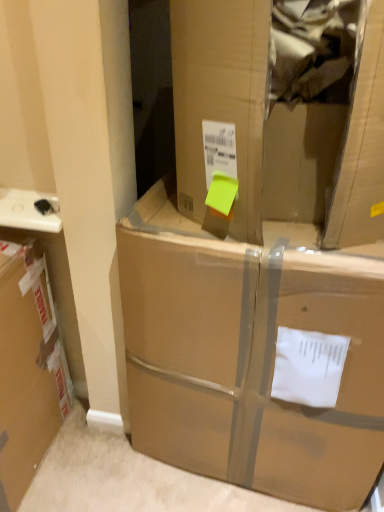
Question: Considering the positions of brown cardboard box at center and brown cardboard box at center in the image, is brown cardboard box at center bigger or smaller than brown cardboard box at center?

Choices:
 (A) big
 (B) small

Answer: (A)

Question: In the image, is brown cardboard box at center on the left side or the right side of brown cardboard box at center?

Choices:
 (A) left
 (B) right

Answer: (A)

Question: Is point (188, 296) positioned closer to the camera than point (281, 201)?

Choices:
 (A) farther
 (B) closer

Answer: (B)

Question: Considering the positions of brown cardboard box at center and brown cardboard box at center in the image, is brown cardboard box at center wider or thinner than brown cardboard box at center?

Choices:
 (A) wide
 (B) thin

Answer: (B)

Question: From their relative heights in the image, would you say brown cardboard box at center is taller or shorter than brown cardboard box at center?

Choices:
 (A) short
 (B) tall

Answer: (A)

Question: Visually, is brown cardboard box at center positioned to the left or to the right of brown cardboard box at center?

Choices:
 (A) right
 (B) left

Answer: (A)

Question: In terms of size, does brown cardboard box at center appear bigger or smaller than brown cardboard box at center?

Choices:
 (A) big
 (B) small

Answer: (B)